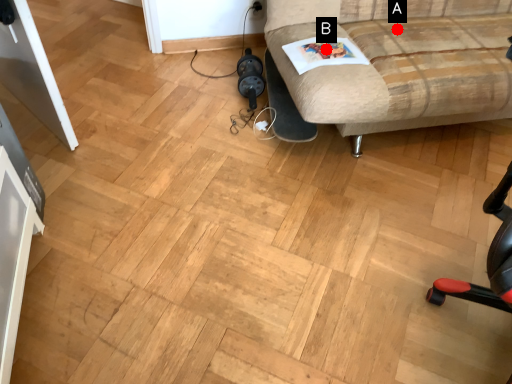
Question: Two points are circled on the image, labeled by A and B beside each circle. Which point appears farthest from the camera in this image?

Choices:
 (A) A is further
 (B) B is further

Answer: (A)